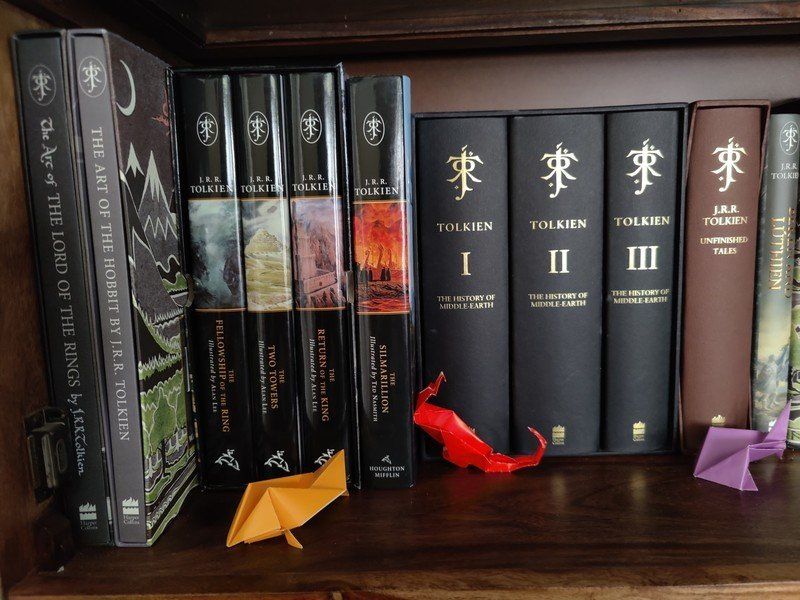
Image resolution: width=800 pixels, height=600 pixels. Find the location of `inside top of shelf`. inside top of shelf is located at coordinates (228, 15).